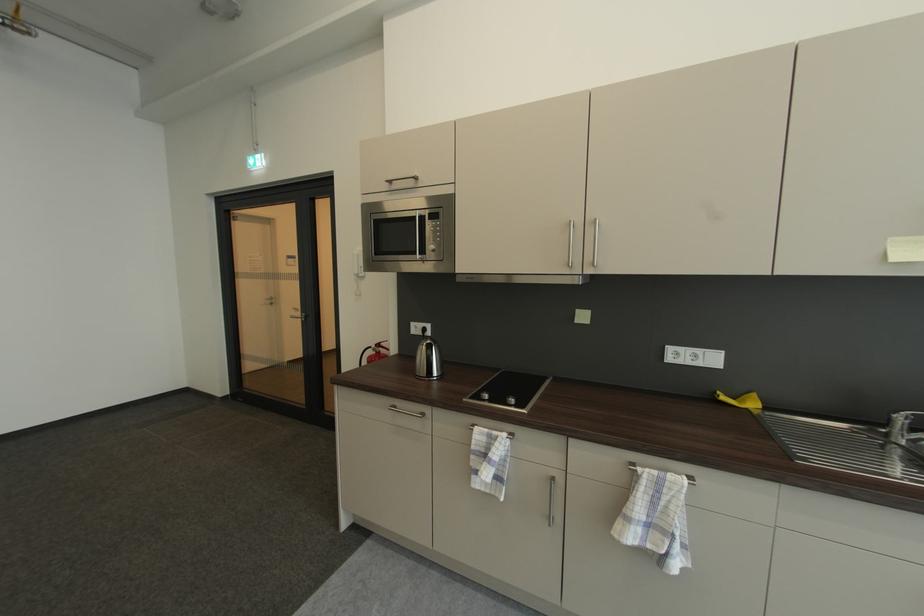
You are a GUI agent. You are given a task and a screenshot of the screen. Output one action in this format:
    pyautogui.click(x=<x>, y=<y>)
    Task: Click on the silver door handle
    The height and width of the screenshot is (616, 924).
    Given the screenshot: What is the action you would take?
    pyautogui.click(x=298, y=315)